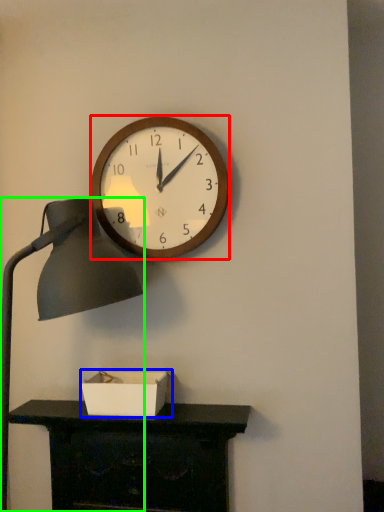
Question: Considering the real-world distances, which object is closest to wall clock (highlighted by a red box)? box (highlighted by a blue box) or lamp (highlighted by a green box).

Choices:
 (A) box
 (B) lamp

Answer: (B)